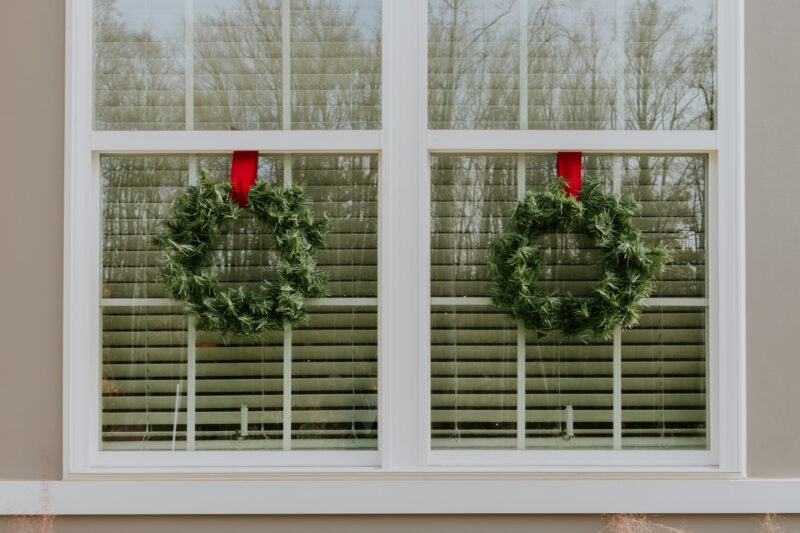
Locate an element on the screen. The height and width of the screenshot is (533, 800). upper right window pane is located at coordinates (670, 68).